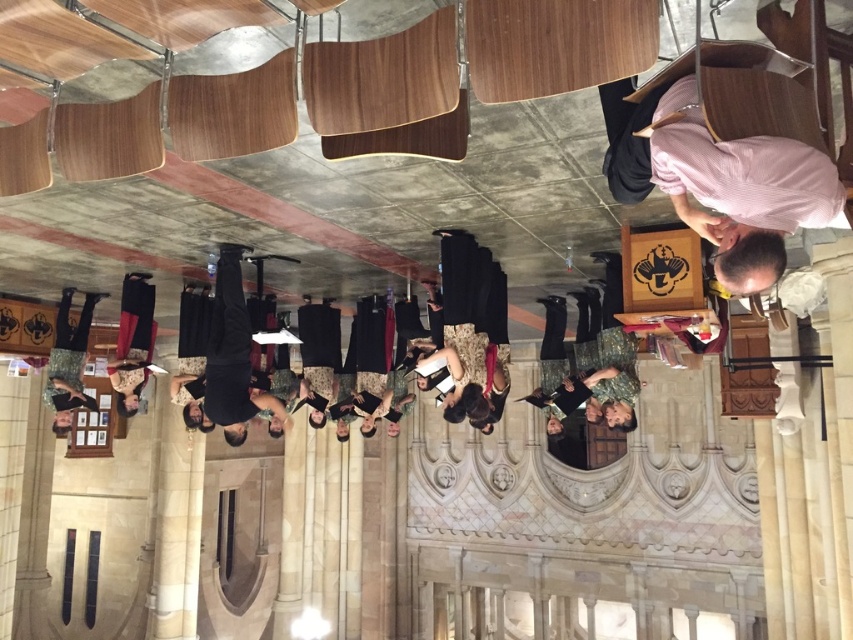
Which is behind, point (219, 300) or point (132, 355)?

Positioned behind is point (132, 355).

Can you confirm if black matte suit at center is positioned below dark green dress at center?

Indeed, black matte suit at center is positioned under dark green dress at center.

Consider the image. Who is more distant from viewer, (x=225, y=356) or (x=144, y=278)?

The point (x=144, y=278) is more distant.

At what (x,y) coordinates should I click in order to perform the action: click on black matte suit at center. Please return your answer as a coordinate pair (x, y). Image resolution: width=853 pixels, height=640 pixels. Looking at the image, I should click on (231, 358).

Does dark green dress at center appear over black dress at lower left?

Yes, dark green dress at center is above black dress at lower left.

Is point (125, 333) farther from camera compared to point (57, 376)?

No.

Identify the location of dark green dress at center. The width and height of the screenshot is (853, 640). (132, 340).

The width and height of the screenshot is (853, 640). In order to click on dark green dress at center in this screenshot , I will do `click(132, 340)`.

Does pink striped shirt at upper right appear over black matte suit at center?

Correct, pink striped shirt at upper right is located above black matte suit at center.

Who is more forward, (631, 100) or (222, 419)?

Positioned in front is point (631, 100).

Is point (633, 157) positioned behind point (248, 332)?

No, it is not.

This screenshot has height=640, width=853. In order to click on pink striped shirt at upper right in this screenshot , I will do pos(718,179).